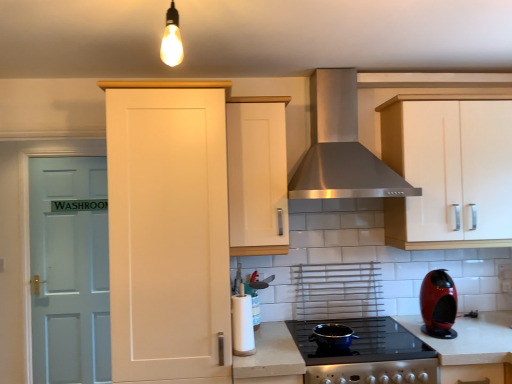
Question: Is matte black pot at center, the 2th appliance viewed from the left, bigger or smaller than black glass cooktop at center?

Choices:
 (A) small
 (B) big

Answer: (A)

Question: Based on their positions, is matte black pot at center, the 2th appliance viewed from the left, located to the left or right of black glass cooktop at center?

Choices:
 (A) right
 (B) left

Answer: (B)

Question: Which object is the closest to the light blue wood door at left?

Choices:
 (A) white paper towel holder at center, which ranks as the first appliance in left-to-right order
 (B) white glossy countertop at lower right
 (C) stainless steel range hood at center
 (D) shiny red coffee machine at right
 (E) matte white cabinet at left, the first cabinetry when ordered from left to right

Answer: (E)

Question: Which object is positioned farthest from the white matte cabinet at upper right, which is the 3th cabinetry in left-to-right order?

Choices:
 (A) light blue wood door at left
 (B) stainless steel range hood at center
 (C) white glossy countertop at lower right
 (D) black glass cooktop at center
 (E) matte white cabinet at center, the 2th cabinetry when ordered from left to right

Answer: (A)